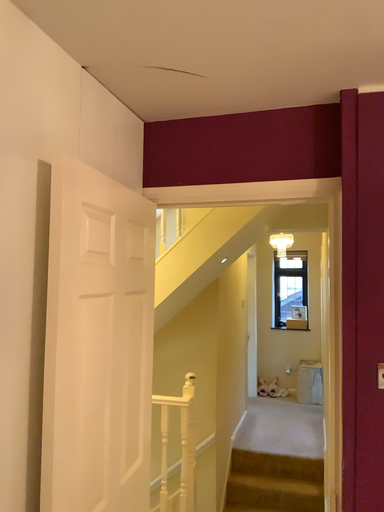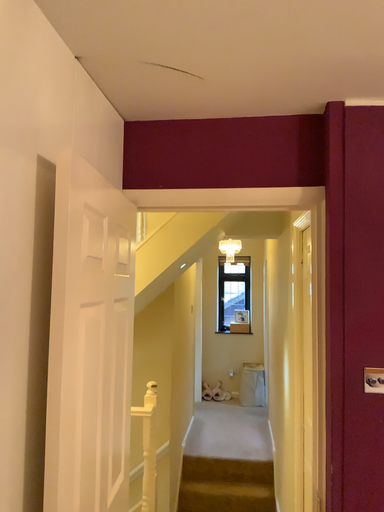
Question: How did the camera likely rotate when shooting the video?

Choices:
 (A) rotated right
 (B) rotated left

Answer: (A)